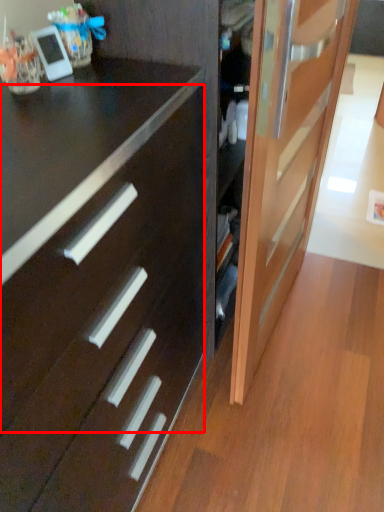
Question: Observing the image, what is the correct spatial positioning of drawer (annotated by the red box) in reference to door?

Choices:
 (A) right
 (B) left

Answer: (B)